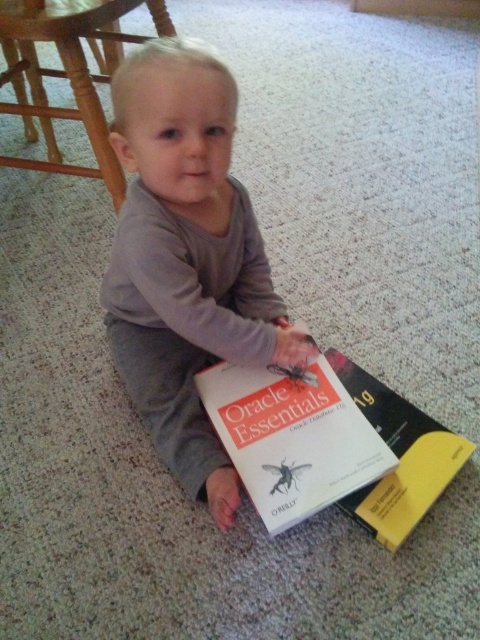
Question: Is white paper book at center to the right of translucent plastic insect at center from the viewer's perspective?

Choices:
 (A) yes
 (B) no

Answer: (A)

Question: Can you confirm if gray matte/soft baby at center is bigger than matte black spider at center?

Choices:
 (A) no
 (B) yes

Answer: (B)

Question: Which point appears farthest from the camera in this image?

Choices:
 (A) (118, 140)
 (B) (309, 484)

Answer: (B)

Question: Among these objects, which one is nearest to the camera?

Choices:
 (A) hardcover book at center
 (B) translucent plastic insect at center
 (C) white paper book at center

Answer: (C)

Question: Which object is positioned farthest from the white paper book at center?

Choices:
 (A) hardcover book at center
 (B) translucent plastic insect at center
 (C) matte black spider at center
 (D) gray matte/soft baby at center

Answer: (D)

Question: Is translucent plastic insect at center positioned in front of matte black spider at center?

Choices:
 (A) yes
 (B) no

Answer: (A)